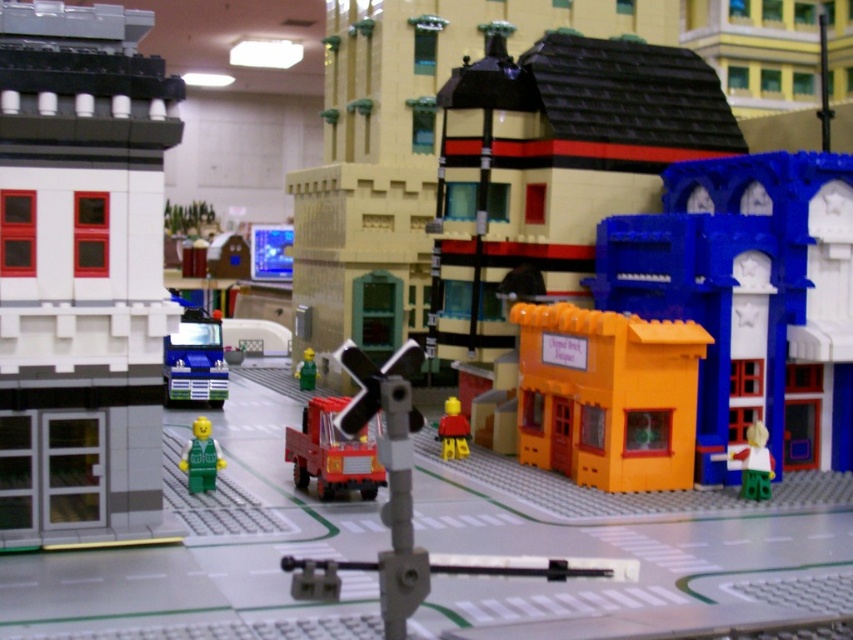
You are a Lego character trying to reach the green matte figure at center from the white matte figure at lower right. Based on their positions, can you directly move upwards without any obstacles?

The white matte figure at lower right is below the green matte figure at center, so you can move upwards directly towards the green matte figure at center without any obstacles.

You are a Lego character trying to hide behind the orange matte building at center and the white matte figure at lower right. Which one can you completely hide behind?

The orange matte building at center is bigger than the white matte figure at lower right, so you can completely hide behind the orange matte building at center.